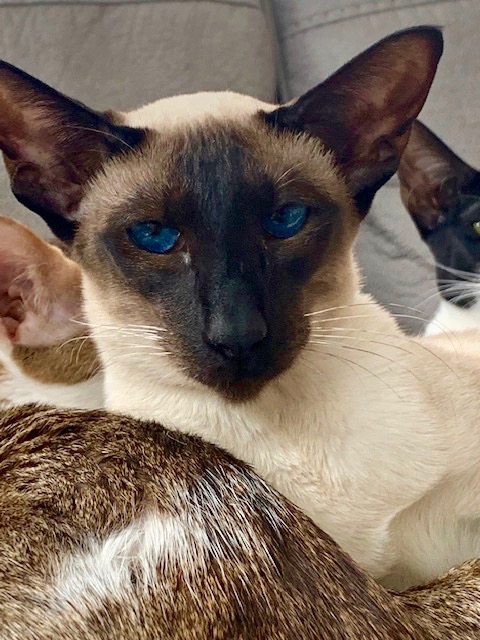
At what (x,y) coordinates should I click in order to perform the action: click on couch. Please return your answer as a coordinate pair (x, y). Looking at the image, I should click on (200, 52), (358, 51).